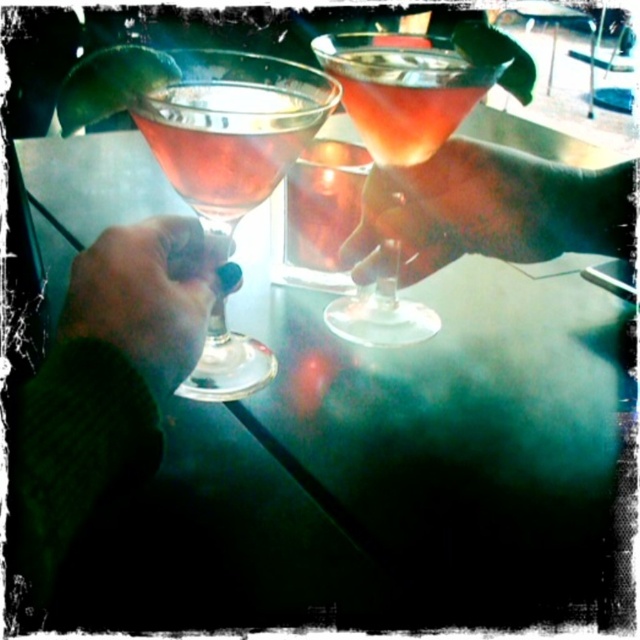
At what (x,y) coordinates should I click in order to perform the action: click on green knitted sweater at left. Please return your answer as a coordinate pair (x, y). The height and width of the screenshot is (640, 640). Looking at the image, I should click on (106, 387).

What do you see at coordinates (106, 387) in the screenshot? Image resolution: width=640 pixels, height=640 pixels. I see `green knitted sweater at left` at bounding box center [106, 387].

I want to click on green knitted sweater at left, so click(x=106, y=387).

Can you confirm if green knitted sweater at left is shorter than translucent glass drink at center?

Incorrect, green knitted sweater at left's height does not fall short of translucent glass drink at center's.

Can you confirm if green knitted sweater at left is taller than translucent glass drink at center?

Yes.

I want to click on green knitted sweater at left, so click(x=106, y=387).

Image resolution: width=640 pixels, height=640 pixels. What are the coordinates of `green knitted sweater at left` in the screenshot? It's located at (106, 387).

Between matte black hand at lower left and matte glass at left, which one has less height?

matte black hand at lower left

Is matte black hand at lower left further to camera compared to matte glass at left?

No, matte black hand at lower left is closer to the viewer.

Looking at this image, who is more forward, (186, 248) or (316, 109)?

Point (316, 109)

At what (x,y) coordinates should I click in order to perform the action: click on matte black hand at lower left. Please return your answer as a coordinate pair (x, y). This screenshot has height=640, width=640. Looking at the image, I should click on (147, 294).